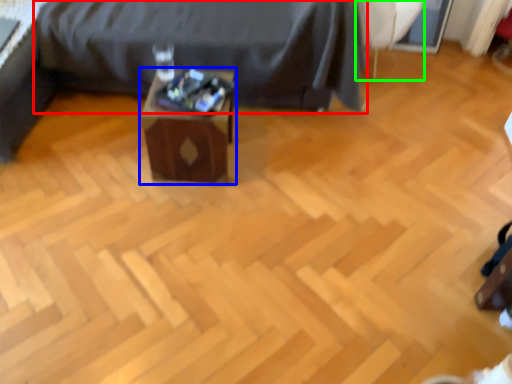
Question: Which object is positioned closest to furniture (highlighted by a red box)? Select from table (highlighted by a blue box) and swivel chair (highlighted by a green box).

Choices:
 (A) table
 (B) swivel chair

Answer: (A)